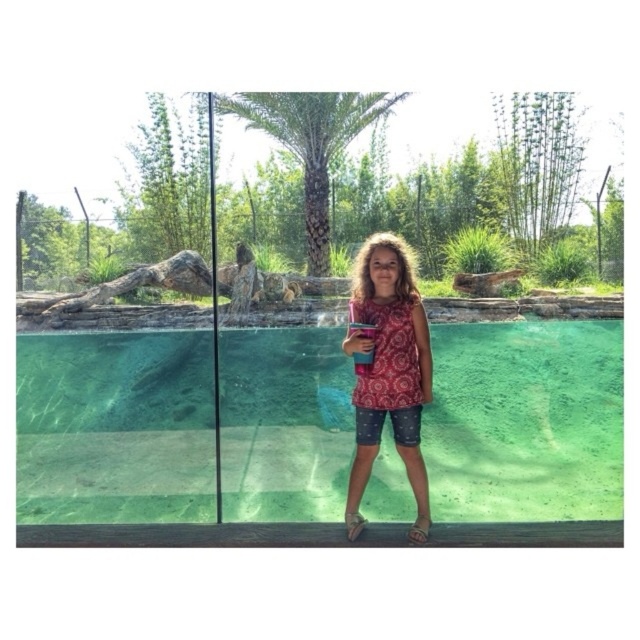
Can you confirm if transparent glass door at center is positioned below clear glass water at center?

Actually, transparent glass door at center is above clear glass water at center.

Who is taller, transparent glass door at center or clear glass water at center?

Standing taller between the two is transparent glass door at center.

Does point (468, 188) come closer to viewer compared to point (468, 444)?

No.

You are a GUI agent. You are given a task and a screenshot of the screen. Output one action in this format:
    pyautogui.click(x=<x>, y=<y>)
    Task: Click on the transparent glass door at center
    The image size is (640, 640).
    Given the screenshot: What is the action you would take?
    pyautogui.click(x=307, y=355)

This screenshot has height=640, width=640. What are the coordinates of `transparent glass door at center` in the screenshot? It's located at (307, 355).

The height and width of the screenshot is (640, 640). What do you see at coordinates (307, 355) in the screenshot?
I see `transparent glass door at center` at bounding box center [307, 355].

Describe the element at coordinates (307, 355) in the screenshot. This screenshot has height=640, width=640. I see `transparent glass door at center` at that location.

Where is `transparent glass door at center`? This screenshot has width=640, height=640. transparent glass door at center is located at coordinates (307, 355).

Describe the element at coordinates (525, 420) in the screenshot. I see `clear glass water at center` at that location.

Does clear glass water at center have a greater width compared to patterned fabric shirt at center?

Yes.

Is point (506, 432) in front of point (381, 308)?

No, (506, 432) is further to viewer.

This screenshot has width=640, height=640. In order to click on clear glass water at center in this screenshot , I will do `click(525, 420)`.